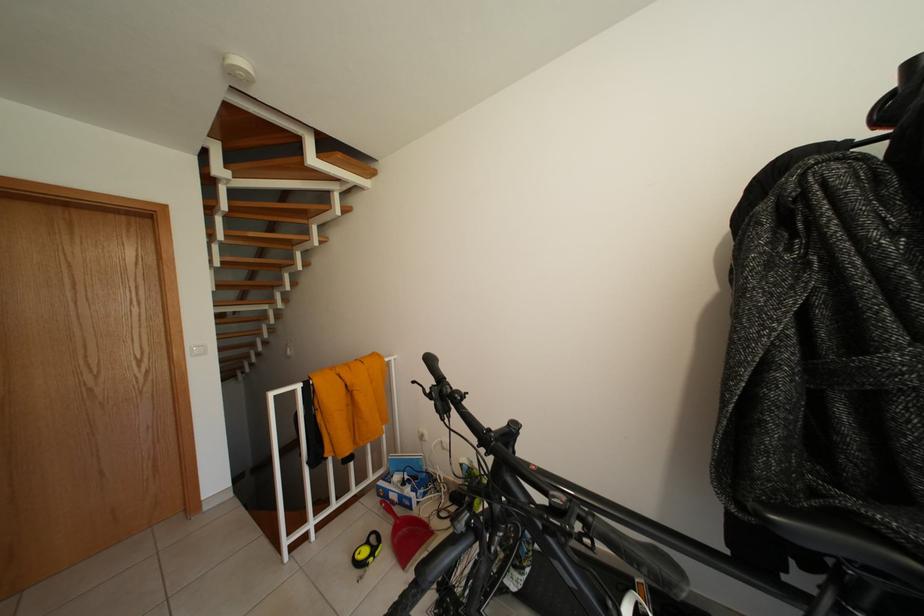
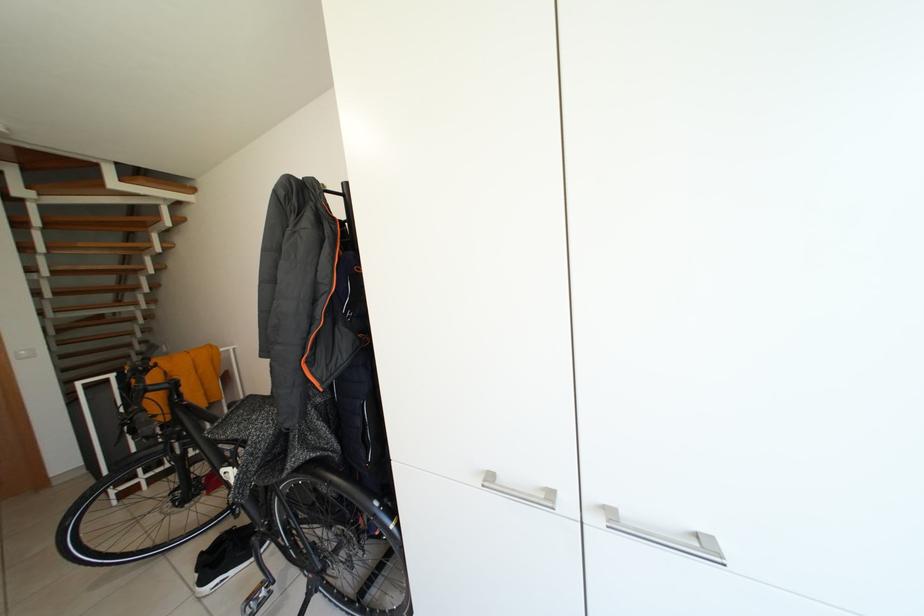
Looking at this image, the images are taken continuously from a first-person perspective. In which direction are you moving?

The cameraman moved toward right, backward.